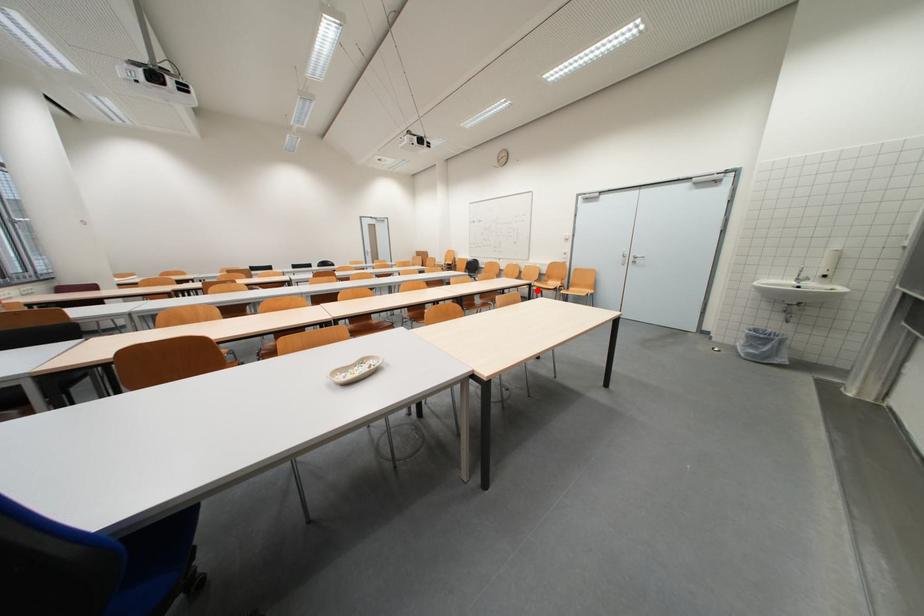
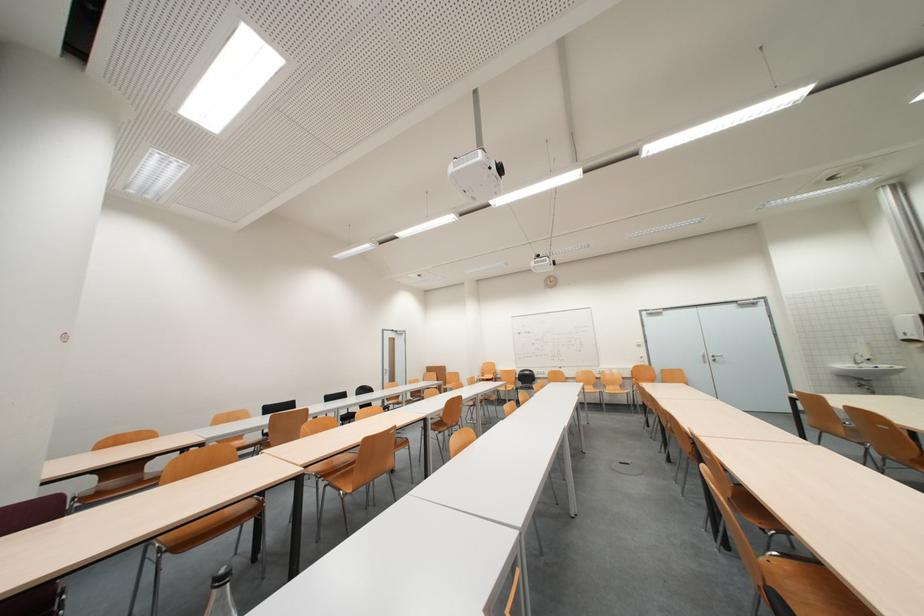
Question: I am providing you with two images of the same scene from different viewpoints. A red point is marked on the first image. Is the red point's position out of view in image 2?

Choices:
 (A) Yes
 (B) No

Answer: (A)